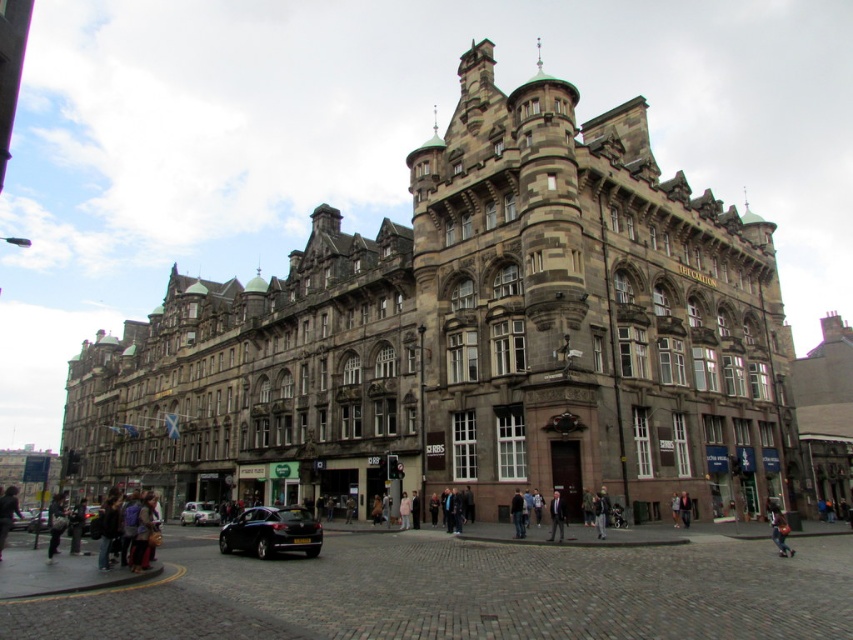
Is pink fabric coat at center below shiny black car at lower left?

Actually, pink fabric coat at center is above shiny black car at lower left.

You are a GUI agent. You are given a task and a screenshot of the screen. Output one action in this format:
    pyautogui.click(x=<x>, y=<y>)
    Task: Click on the pink fabric coat at center
    
    Given the screenshot: What is the action you would take?
    pyautogui.click(x=404, y=509)

Find the location of `pink fabric coat at center`. pink fabric coat at center is located at coordinates (404, 509).

Is shiny black car at center bigger than dark brown leather jacket at lower left?

No, shiny black car at center is not bigger than dark brown leather jacket at lower left.

Is shiny black car at center to the left of dark brown leather jacket at lower left from the viewer's perspective?

In fact, shiny black car at center is to the right of dark brown leather jacket at lower left.

Find the location of a particular element. The height and width of the screenshot is (640, 853). shiny black car at center is located at coordinates (271, 531).

Does metallic silver car at center have a larger size compared to light brown leather jacket at center?

Correct, metallic silver car at center is larger in size than light brown leather jacket at center.

Is metallic silver car at center to the right of light brown leather jacket at center from the viewer's perspective?

Incorrect, metallic silver car at center is not on the right side of light brown leather jacket at center.

What do you see at coordinates (198, 513) in the screenshot? I see `metallic silver car at center` at bounding box center [198, 513].

The width and height of the screenshot is (853, 640). Identify the location of metallic silver car at center. (198, 513).